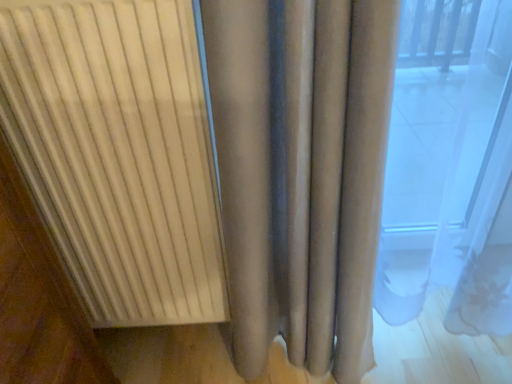
Where is `white matte radiator at left`? white matte radiator at left is located at coordinates (118, 153).

Describe the element at coordinates (118, 153) in the screenshot. Image resolution: width=512 pixels, height=384 pixels. I see `white matte radiator at left` at that location.

Measure the distance between white matte radiator at left and camera.

The distance of white matte radiator at left from camera is 26.30 inches.

I want to click on white matte radiator at left, so click(x=118, y=153).